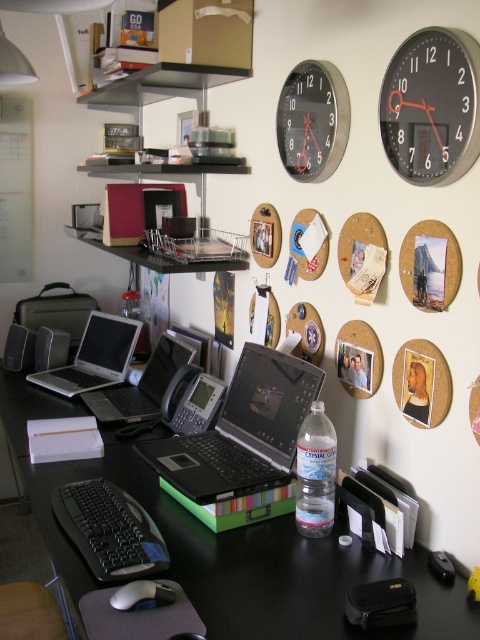
Question: Among these objects, which one is nearest to the camera?

Choices:
 (A) black matte laptop at center
 (B) silver/black laptop at center
 (C) black metallic clock at upper center

Answer: (A)

Question: Does black plastic computer desk at center appear on the left side of silver/black laptop at center?

Choices:
 (A) yes
 (B) no

Answer: (B)

Question: Which object is the closest to the black metallic clock at upper center?

Choices:
 (A) silver/black laptop at center
 (B) black matte laptop at center

Answer: (B)

Question: Estimate the real-world distances between objects in this image. Which object is farther from the silver/black laptop at center?

Choices:
 (A) black matte laptop at center
 (B) black plastic laptop at center
 (C) black metallic clock at upper right
 (D) black plastic computer desk at center

Answer: (C)

Question: Can you confirm if black plastic laptop at center is smaller than white matte mouse at lower left?

Choices:
 (A) yes
 (B) no

Answer: (B)

Question: Is black plastic computer desk at center to the right of black matte laptop at center from the viewer's perspective?

Choices:
 (A) no
 (B) yes

Answer: (A)